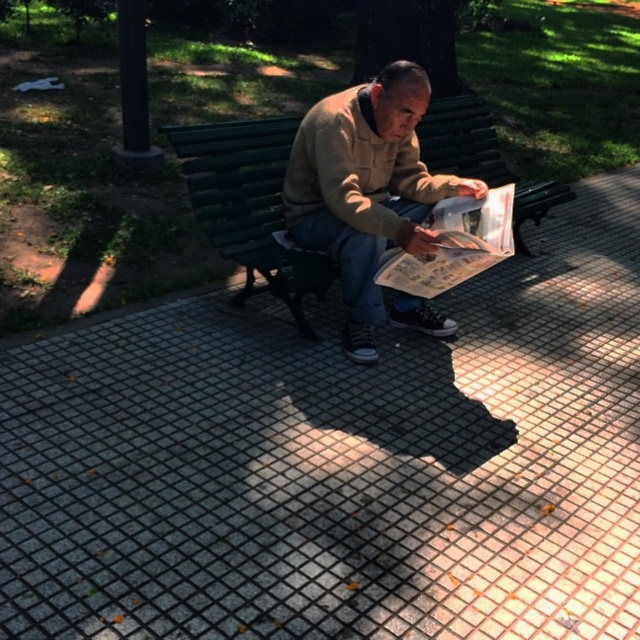
Which is more to the left, light brown suede jacket at center or green wood bench at center?

From the viewer's perspective, green wood bench at center appears more on the left side.

Describe the element at coordinates (365, 188) in the screenshot. This screenshot has width=640, height=640. I see `light brown suede jacket at center` at that location.

Measure the distance between point (307, 230) and camera.

Point (307, 230) is 2.48 meters from camera.

Where is `light brown suede jacket at center`? The height and width of the screenshot is (640, 640). light brown suede jacket at center is located at coordinates (365, 188).